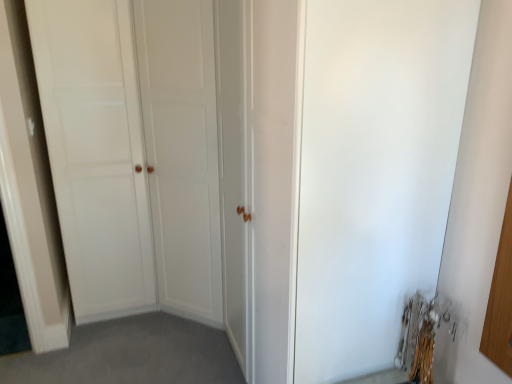
Question: Is point (92, 104) positioned closer to the camera than point (439, 142)?

Choices:
 (A) closer
 (B) farther

Answer: (B)

Question: From their relative heights in the image, would you say white matte door at center is taller or shorter than white matte screen door at center?

Choices:
 (A) tall
 (B) short

Answer: (A)

Question: Looking at the image, does white matte door at center seem bigger or smaller compared to white matte screen door at center?

Choices:
 (A) big
 (B) small

Answer: (A)

Question: Considering their positions, is white matte screen door at center located in front of or behind white matte door at center?

Choices:
 (A) behind
 (B) front

Answer: (B)

Question: From a real-world perspective, is white matte screen door at center above or below white matte door at center?

Choices:
 (A) above
 (B) below

Answer: (B)

Question: Does point (410, 3) appear closer or farther from the camera than point (150, 268)?

Choices:
 (A) closer
 (B) farther

Answer: (A)

Question: From the image's perspective, relative to white matte door at center, is white matte screen door at center above or below?

Choices:
 (A) below
 (B) above

Answer: (A)